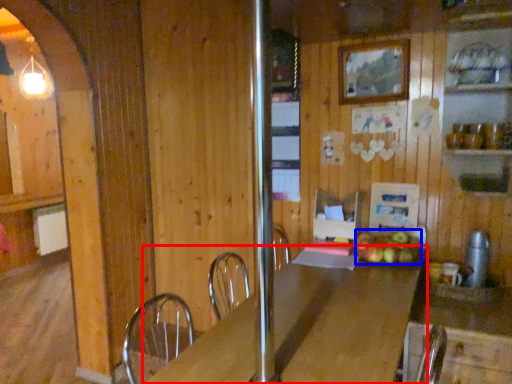
Question: Which point is closer to the camera, table (highlighted by a red box) or apple (highlighted by a blue box)?

Choices:
 (A) table
 (B) apple

Answer: (A)